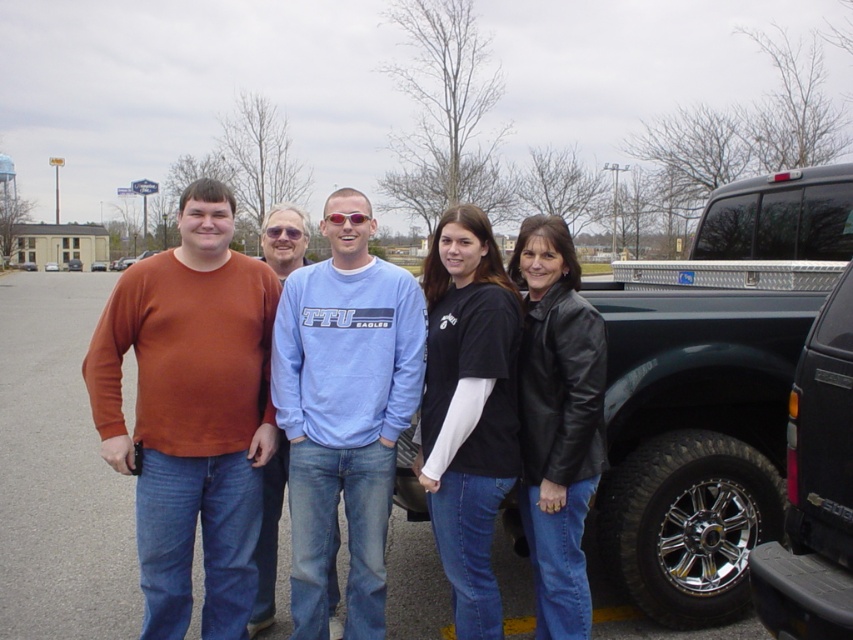
Between black leather jacket at right and black metallic truck at right, which one has more height?

With more height is black leather jacket at right.

Who is higher up, black leather jacket at right or black metallic truck at right?

black metallic truck at right is above.

Who is more distant from viewer, (555,611) or (799,566)?

Positioned behind is point (555,611).

The height and width of the screenshot is (640, 853). Find the location of `black leather jacket at right`. black leather jacket at right is located at coordinates (556, 420).

Between light blue cotton shirt at center and black metallic truck at right, which one is positioned lower?

light blue cotton shirt at center is below.

Does point (347, 552) come farther from viewer compared to point (769, 570)?

Yes, it is behind point (769, 570).

Image resolution: width=853 pixels, height=640 pixels. Identify the location of light blue cotton shirt at center. (344, 417).

Does black metallic truck at right have a larger size compared to matte blue shirt at center?

Actually, black metallic truck at right might be smaller than matte blue shirt at center.

Find the location of a particular element. This screenshot has height=640, width=853. black metallic truck at right is located at coordinates (814, 490).

The height and width of the screenshot is (640, 853). What are the coordinates of `black metallic truck at right` in the screenshot? It's located at (814, 490).